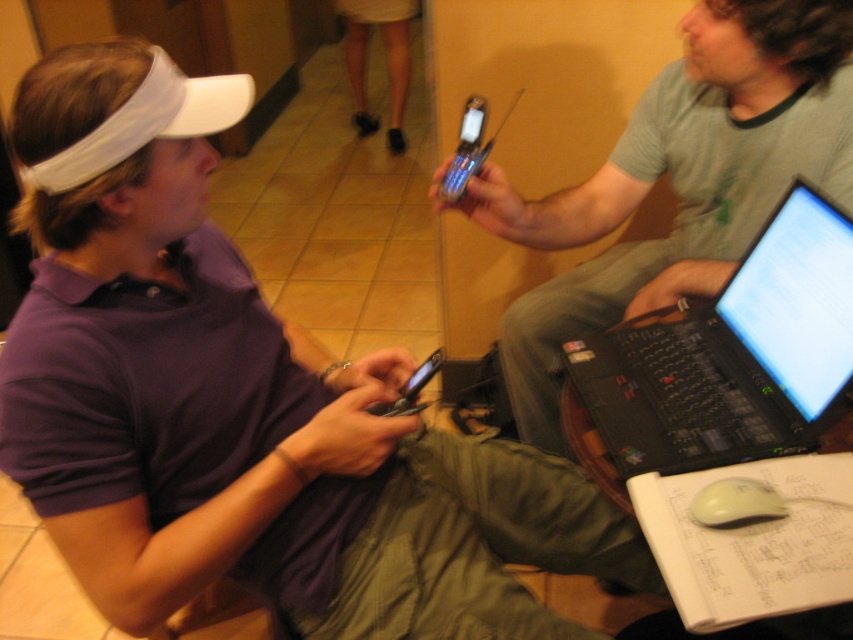
You are taking a photo of the two people in the scene. The first person is at point (96, 248) and the second is at point (355, 38). Which person will appear larger in your photo?

The person at point (96, 248) will appear larger in the photo because they are closer to the camera than the person at point (355, 38).

You are organizing a small event and need to determine which item takes up more space. You see the light beige skirt at upper center and the white matte mouse at lower right. Which object requires more space?

The light beige skirt at upper center requires more space as it is larger in size than the white matte mouse at lower right.

You are a delivery robot with a package that needs to be placed between the light beige skirt at upper center and the silver metallic phone at center. The package requires a minimum of 3 meters of space to safely place it. Can you fit the package between them?

The light beige skirt at upper center and the silver metallic phone at center are 2.58 meters apart from each other, which is less than the required 3 meters. Therefore, the package cannot be safely placed between them.